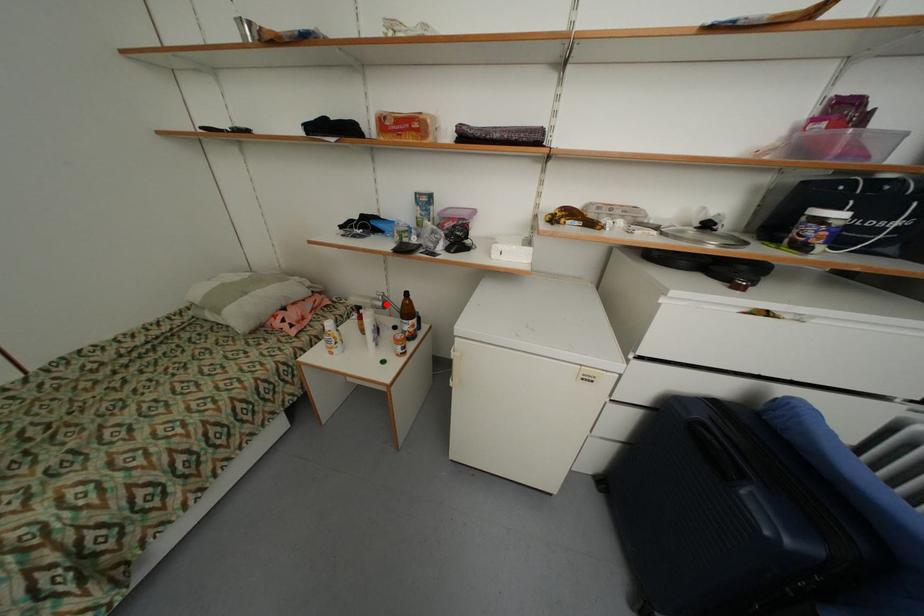
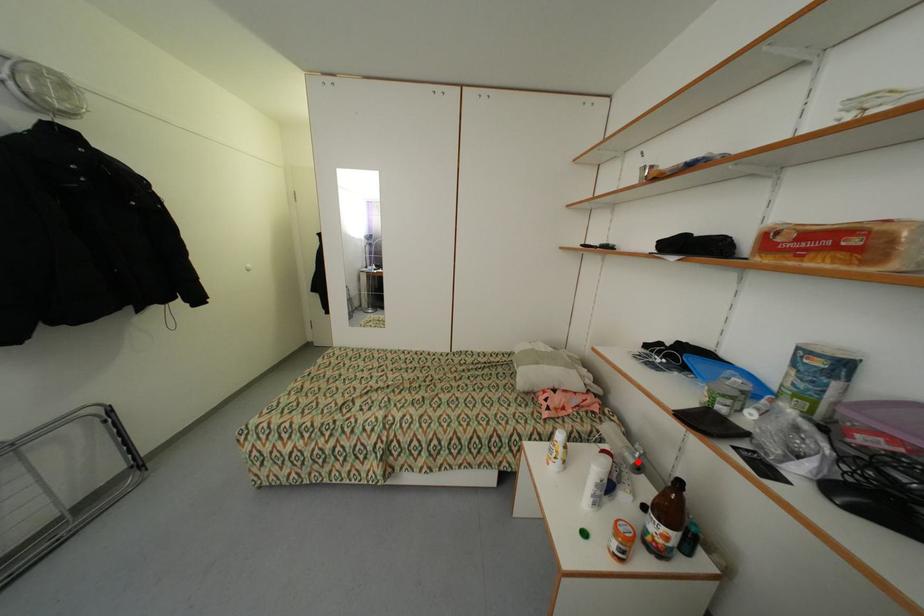
I am providing you with two images of the same scene from different viewpoints. A red point is marked on the first image and another point is marked on the second image. Is the marked point in image1 the same physical position as the marked point in image2?

Yes